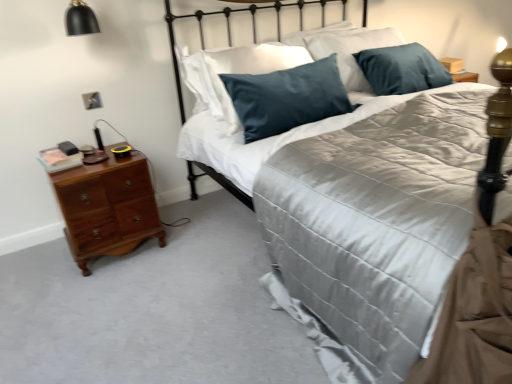
Question: Is black matte lampshade at upper left surrounding satin black headboard at upper center?

Choices:
 (A) no
 (B) yes

Answer: (A)

Question: From the image's perspective, is black matte lampshade at upper left located beneath satin black headboard at upper center?

Choices:
 (A) yes
 (B) no

Answer: (B)

Question: Does black matte lampshade at upper left have a smaller size compared to satin black headboard at upper center?

Choices:
 (A) yes
 (B) no

Answer: (A)

Question: From a real-world perspective, is black matte lampshade at upper left positioned under satin black headboard at upper center based on gravity?

Choices:
 (A) yes
 (B) no

Answer: (B)

Question: Considering the relative sizes of black matte lampshade at upper left and satin black headboard at upper center in the image provided, is black matte lampshade at upper left wider than satin black headboard at upper center?

Choices:
 (A) yes
 (B) no

Answer: (B)

Question: From the image's perspective, is matte silver outlet at lower left located above or below satin black headboard at upper center?

Choices:
 (A) above
 (B) below

Answer: (B)

Question: From their relative heights in the image, would you say matte silver outlet at lower left is taller or shorter than satin black headboard at upper center?

Choices:
 (A) short
 (B) tall

Answer: (A)

Question: From a real-world perspective, is matte silver outlet at lower left above or below satin black headboard at upper center?

Choices:
 (A) below
 (B) above

Answer: (A)

Question: Is point (98, 102) positioned closer to the camera than point (364, 11)?

Choices:
 (A) farther
 (B) closer

Answer: (B)

Question: Is cherry wood nightstand at left spatially inside satin black headboard at upper center, or outside of it?

Choices:
 (A) inside
 (B) outside

Answer: (B)

Question: From a real-world perspective, is cherry wood nightstand at left above or below satin black headboard at upper center?

Choices:
 (A) above
 (B) below

Answer: (B)

Question: In terms of width, does cherry wood nightstand at left look wider or thinner when compared to satin black headboard at upper center?

Choices:
 (A) wide
 (B) thin

Answer: (B)

Question: Considering their positions, is cherry wood nightstand at left located in front of or behind satin black headboard at upper center?

Choices:
 (A) behind
 (B) front

Answer: (A)

Question: Considering the relative positions of satin black headboard at upper center and cherry wood nightstand at left in the image provided, is satin black headboard at upper center to the left or to the right of cherry wood nightstand at left?

Choices:
 (A) left
 (B) right

Answer: (B)

Question: Considering the positions of satin black headboard at upper center and cherry wood nightstand at left in the image, is satin black headboard at upper center bigger or smaller than cherry wood nightstand at left?

Choices:
 (A) big
 (B) small

Answer: (A)